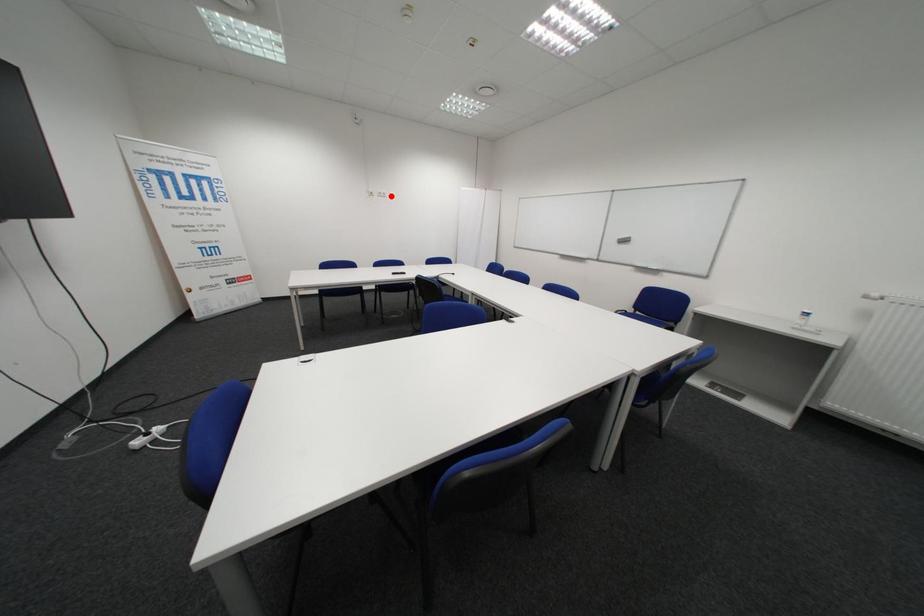
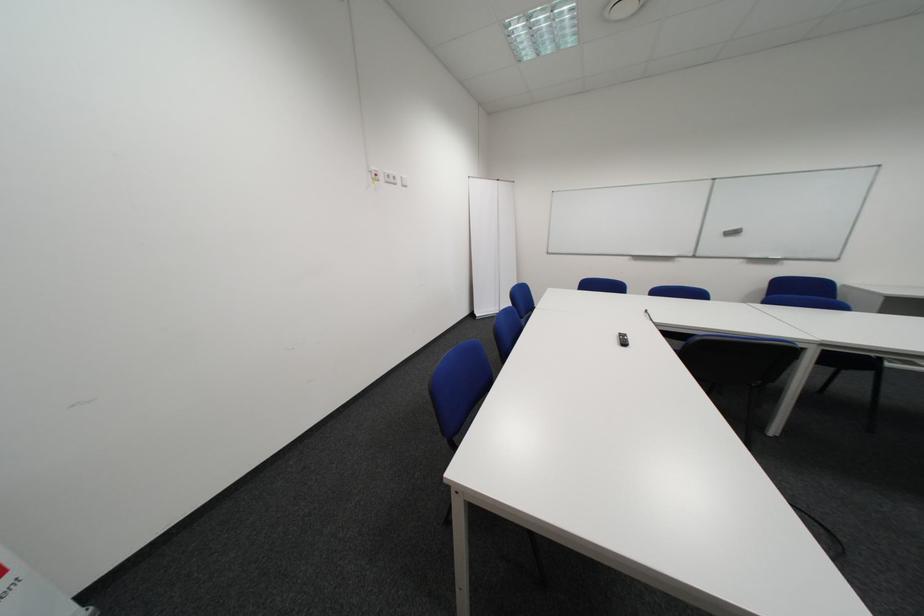
Find the pixel in the second image that matches the highlighted location in the first image.

(398, 180)